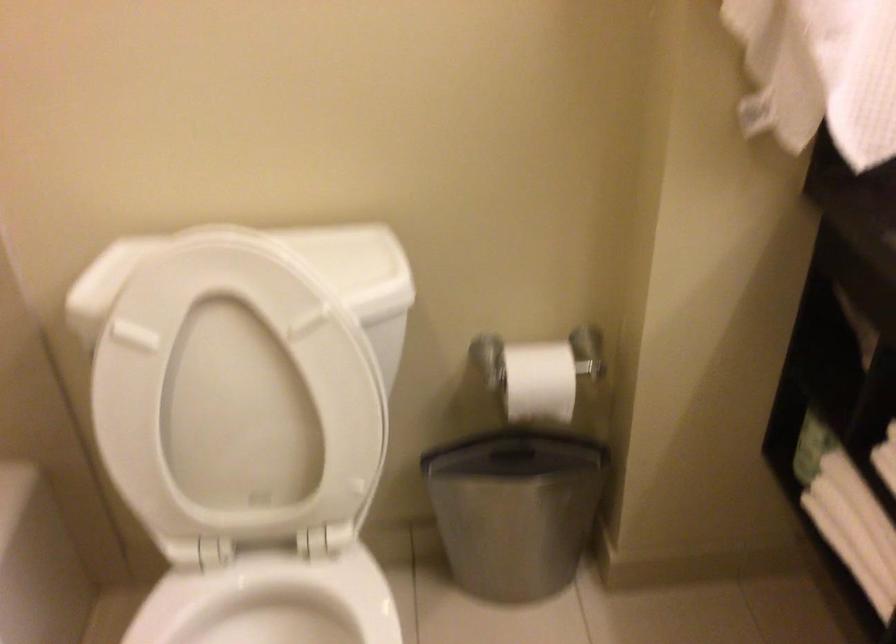
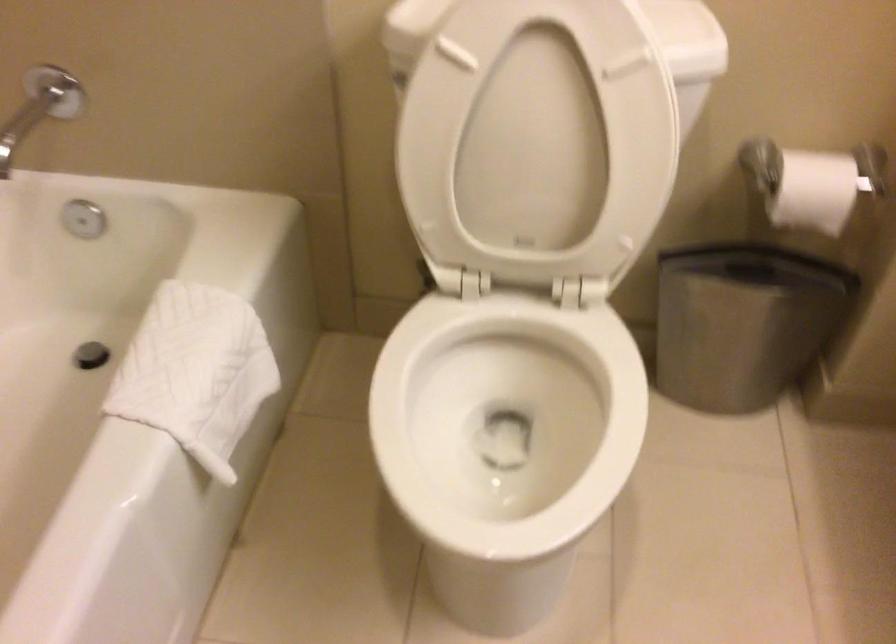
In the second image, find the point that corresponds to pixel 510 516 in the first image.

(743, 323)